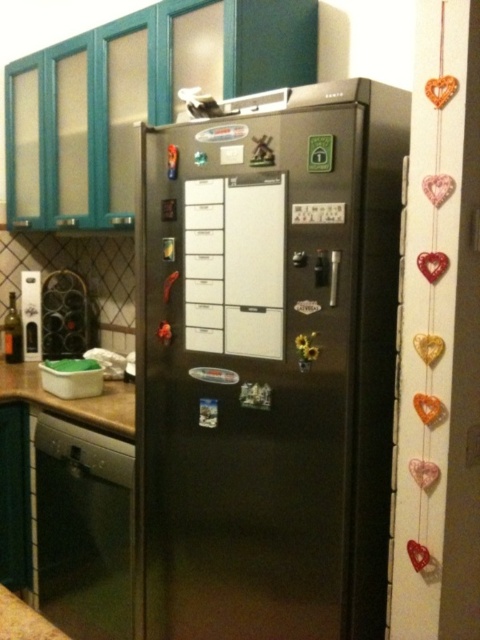
Question: Which of the following is the closest to the observer?

Choices:
 (A) (224, 333)
 (B) (64, 518)
 (C) (14, 396)

Answer: (A)

Question: Which object is the farthest from the satin black refrigerator at center?

Choices:
 (A) brown wood countertop at lower left
 (B) satin black dishwasher at lower left

Answer: (A)

Question: Is satin black dishwasher at lower left smaller than brown wood countertop at lower left?

Choices:
 (A) yes
 (B) no

Answer: (B)

Question: Is satin black dishwasher at lower left positioned behind brown wood countertop at lower left?

Choices:
 (A) yes
 (B) no

Answer: (B)

Question: Is satin black refrigerator at center above satin black dishwasher at lower left?

Choices:
 (A) yes
 (B) no

Answer: (A)

Question: Among these objects, which one is nearest to the camera?

Choices:
 (A) satin black dishwasher at lower left
 (B) brown wood countertop at lower left

Answer: (A)